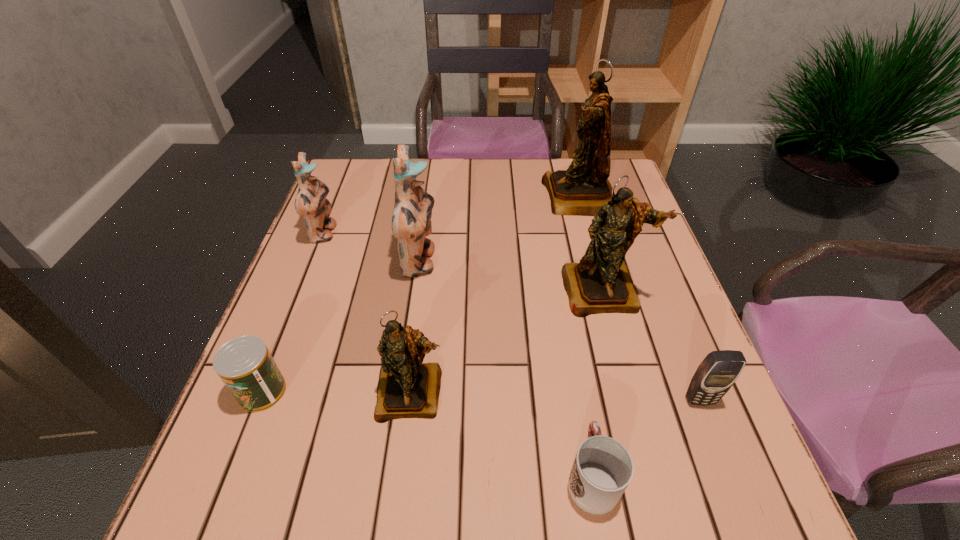
Locate an element on the screen. free location at the far edge is located at coordinates coord(502,172).

Locate an element on the screen. The height and width of the screenshot is (540, 960). free space at the left edge is located at coordinates (364, 209).

The width and height of the screenshot is (960, 540). In order to click on free space between the nearest figurine and the farthest gold figurine in this screenshot , I will do `click(495, 295)`.

Locate an element on the screen. The image size is (960, 540). unoccupied area between the red cup and the farthest gold figurine is located at coordinates point(586,336).

Identify the location of free space that is in between the second biggest gold figurine and the cellular telephone. (652, 345).

Image resolution: width=960 pixels, height=540 pixels. What are the coordinates of `empty space that is in between the second nearest gold figurine and the right pink figurine` in the screenshot? It's located at (511, 276).

Identify the location of free point between the red cup and the can. The width and height of the screenshot is (960, 540). (427, 434).

Identify the location of vacant area that lies between the seventh tallest object and the shortest object. (427, 434).

Locate an element on the screen. empty space between the cup and the second farthest gold figurine is located at coordinates point(597,383).

This screenshot has height=540, width=960. Identify the location of vacant area between the leftmost gold figurine and the second shortest object. (337, 392).